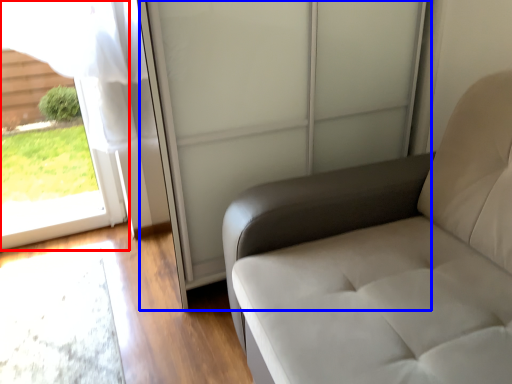
Question: Which point is further to the camera, window (highlighted by a red box) or screen door (highlighted by a blue box)?

Choices:
 (A) window
 (B) screen door

Answer: (A)